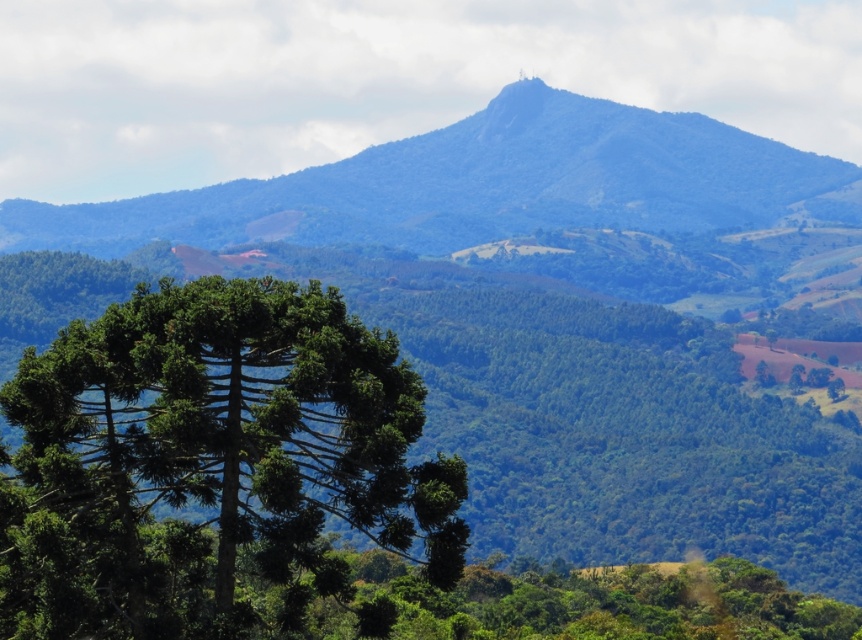
Can you confirm if green textured tree at center is positioned below blue-green textured mountain at upper center?

Indeed, green textured tree at center is positioned under blue-green textured mountain at upper center.

Who is taller, green textured tree at center or blue-green textured mountain at upper center?

blue-green textured mountain at upper center is taller.

Which is behind, point (228, 362) or point (721, 145)?

Positioned behind is point (721, 145).

The image size is (862, 640). Find the location of `green textured tree at center`. green textured tree at center is located at coordinates (211, 461).